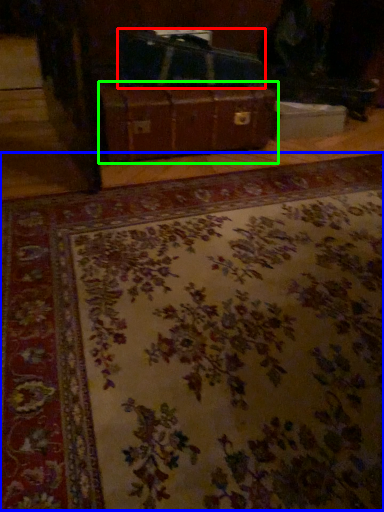
Question: Which object is the closest to the luggage (highlighted by a red box)? Choose among these: mat (highlighted by a blue box) or suitcase (highlighted by a green box).

Choices:
 (A) mat
 (B) suitcase

Answer: (B)